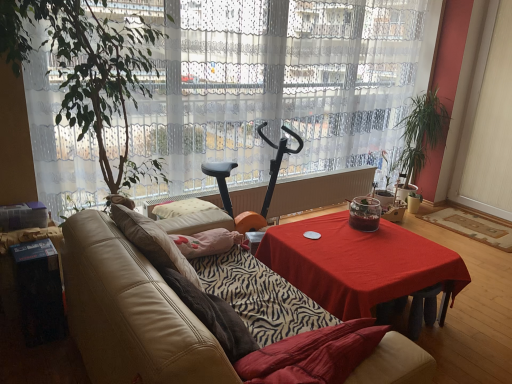
Question: Considering the relative sizes of red cloth-covered table at center and white plastic radiator at center in the image provided, is red cloth-covered table at center shorter than white plastic radiator at center?

Choices:
 (A) no
 (B) yes

Answer: (A)

Question: Is red cloth-covered table at center not near white plastic radiator at center?

Choices:
 (A) yes
 (B) no

Answer: (A)

Question: From a real-world perspective, is red cloth-covered table at center over white plastic radiator at center?

Choices:
 (A) no
 (B) yes

Answer: (A)

Question: Considering the relative sizes of red cloth-covered table at center and white plastic radiator at center in the image provided, is red cloth-covered table at center smaller than white plastic radiator at center?

Choices:
 (A) yes
 (B) no

Answer: (B)

Question: Can you confirm if red cloth-covered table at center is taller than white plastic radiator at center?

Choices:
 (A) no
 (B) yes

Answer: (B)

Question: Is red cloth-covered table at center located outside white plastic radiator at center?

Choices:
 (A) yes
 (B) no

Answer: (A)

Question: Could you tell me if black plastic exercise bike at center is turned towards white sheer curtain at center?

Choices:
 (A) no
 (B) yes

Answer: (A)

Question: From the image's perspective, is black plastic exercise bike at center located beneath white sheer curtain at center?

Choices:
 (A) yes
 (B) no

Answer: (A)

Question: Is black plastic exercise bike at center at the right side of white sheer curtain at center?

Choices:
 (A) no
 (B) yes

Answer: (A)

Question: Does black plastic exercise bike at center have a lesser width compared to white sheer curtain at center?

Choices:
 (A) yes
 (B) no

Answer: (B)

Question: Is white sheer curtain at center surrounded by black plastic exercise bike at center?

Choices:
 (A) yes
 (B) no

Answer: (B)

Question: Does black plastic exercise bike at center come behind white sheer curtain at center?

Choices:
 (A) yes
 (B) no

Answer: (A)

Question: Does green leafy plant at left, placed as the 2th houseplant when sorted from right to left, appear on the left side of transparent glass jar at center?

Choices:
 (A) no
 (B) yes

Answer: (B)